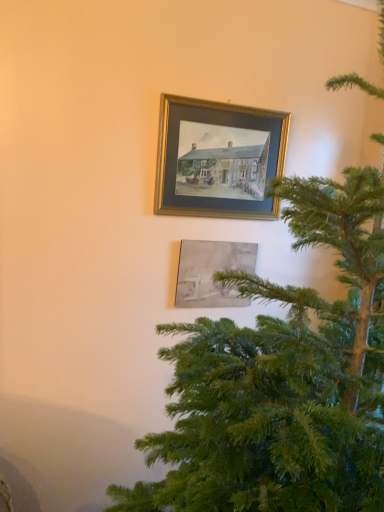
What do you see at coordinates (211, 272) in the screenshot?
I see `gray matte painting at lower center, arranged as the second picture frame when viewed from the top` at bounding box center [211, 272].

The width and height of the screenshot is (384, 512). Find the location of `green textured christmas tree at right`. green textured christmas tree at right is located at coordinates (283, 379).

Considering the sizes of green textured christmas tree at right and gray matte painting at lower center, arranged as the 1th picture frame when ordered from the bottom, in the image, is green textured christmas tree at right bigger or smaller than gray matte painting at lower center, arranged as the 1th picture frame when ordered from the bottom,?

Considering their sizes, green textured christmas tree at right takes up more space than gray matte painting at lower center, arranged as the 1th picture frame when ordered from the bottom.

Can you confirm if green textured christmas tree at right is positioned to the left of gray matte painting at lower center, arranged as the second picture frame when viewed from the top?

No, green textured christmas tree at right is not to the left of gray matte painting at lower center, arranged as the second picture frame when viewed from the top.

Can you tell me how much green textured christmas tree at right and gray matte painting at lower center, arranged as the second picture frame when viewed from the top, differ in facing direction?

The angular difference between green textured christmas tree at right and gray matte painting at lower center, arranged as the second picture frame when viewed from the top, is 86 degrees.

Is green textured christmas tree at right facing towards gray matte painting at lower center, arranged as the second picture frame when viewed from the top?

No, green textured christmas tree at right is not aimed at gray matte painting at lower center, arranged as the second picture frame when viewed from the top.

Is gold metallic picture frame at upper center, which is the 2th picture frame in bottom-to-top order, spatially inside green textured christmas tree at right, or outside of it?

gold metallic picture frame at upper center, which is the 2th picture frame in bottom-to-top order, is spatially situated outside green textured christmas tree at right.

The height and width of the screenshot is (512, 384). In order to click on christmas tree that is in front of the gold metallic picture frame at upper center, which is counted as the 1th picture frame, starting from the top in this screenshot , I will do `click(283, 379)`.

From a real-world perspective, is gold metallic picture frame at upper center, which is counted as the 1th picture frame, starting from the top, physically located above or below green textured christmas tree at right?

In terms of real-world spatial position, gold metallic picture frame at upper center, which is counted as the 1th picture frame, starting from the top, is above green textured christmas tree at right.

Which is more to the right, gold metallic picture frame at upper center, which is counted as the 1th picture frame, starting from the top, or green textured christmas tree at right?

green textured christmas tree at right.

From a real-world perspective, is gray matte painting at lower center, arranged as the 1th picture frame when ordered from the bottom, on gold metallic picture frame at upper center, which is the 2th picture frame in bottom-to-top order?

No, from a real-world perspective, gray matte painting at lower center, arranged as the 1th picture frame when ordered from the bottom, is not above gold metallic picture frame at upper center, which is the 2th picture frame in bottom-to-top order.

Is gray matte painting at lower center, arranged as the 1th picture frame when ordered from the bottom, oriented towards gold metallic picture frame at upper center, which is counted as the 1th picture frame, starting from the top?

No, gray matte painting at lower center, arranged as the 1th picture frame when ordered from the bottom, is not oriented towards gold metallic picture frame at upper center, which is counted as the 1th picture frame, starting from the top.

At what (x,y) coordinates should I click in order to perform the action: click on picture frame that is above the gray matte painting at lower center, arranged as the second picture frame when viewed from the top (from a real-world perspective). Please return your answer as a coordinate pair (x, y). Looking at the image, I should click on point(218,159).

Is gray matte painting at lower center, arranged as the second picture frame when viewed from the top, not inside gold metallic picture frame at upper center, which is counted as the 1th picture frame, starting from the top?

Yes, gray matte painting at lower center, arranged as the second picture frame when viewed from the top, is outside of gold metallic picture frame at upper center, which is counted as the 1th picture frame, starting from the top.

From a real-world perspective, who is located lower, gray matte painting at lower center, arranged as the second picture frame when viewed from the top, or green textured christmas tree at right?

green textured christmas tree at right, from a real-world perspective.

Does gray matte painting at lower center, arranged as the 1th picture frame when ordered from the bottom, have a lesser height compared to green textured christmas tree at right?

Correct, gray matte painting at lower center, arranged as the 1th picture frame when ordered from the bottom, is not as tall as green textured christmas tree at right.

Does gray matte painting at lower center, arranged as the second picture frame when viewed from the top, appear on the left side of green textured christmas tree at right?

Correct, you'll find gray matte painting at lower center, arranged as the second picture frame when viewed from the top, to the left of green textured christmas tree at right.

Between green textured christmas tree at right and gold metallic picture frame at upper center, which is the 2th picture frame in bottom-to-top order, which one appears on the right side from the viewer's perspective?

From the viewer's perspective, green textured christmas tree at right appears more on the right side.

Who is shorter, green textured christmas tree at right or gold metallic picture frame at upper center, which is the 2th picture frame in bottom-to-top order?

With less height is gold metallic picture frame at upper center, which is the 2th picture frame in bottom-to-top order.

Is green textured christmas tree at right placed right next to gold metallic picture frame at upper center, which is the 2th picture frame in bottom-to-top order?

There is a gap between green textured christmas tree at right and gold metallic picture frame at upper center, which is the 2th picture frame in bottom-to-top order.

Who is bigger, green textured christmas tree at right or gold metallic picture frame at upper center, which is counted as the 1th picture frame, starting from the top?

green textured christmas tree at right is bigger.

In the image, is gold metallic picture frame at upper center, which is counted as the 1th picture frame, starting from the top, on the left side or the right side of gray matte painting at lower center, arranged as the 1th picture frame when ordered from the bottom?

From the image, it's evident that gold metallic picture frame at upper center, which is counted as the 1th picture frame, starting from the top, is to the right of gray matte painting at lower center, arranged as the 1th picture frame when ordered from the bottom.

Is gold metallic picture frame at upper center, which is the 2th picture frame in bottom-to-top order, taller or shorter than gray matte painting at lower center, arranged as the 1th picture frame when ordered from the bottom?

Considering their sizes, gold metallic picture frame at upper center, which is the 2th picture frame in bottom-to-top order, has more height than gray matte painting at lower center, arranged as the 1th picture frame when ordered from the bottom.

The height and width of the screenshot is (512, 384). In the image, there is a gold metallic picture frame at upper center, which is counted as the 1th picture frame, starting from the top. In order to click on picture frame below it (from the image's perspective) in this screenshot , I will do `click(211, 272)`.

Is gold metallic picture frame at upper center, which is counted as the 1th picture frame, starting from the top, not near gray matte painting at lower center, arranged as the second picture frame when viewed from the top?

No, gold metallic picture frame at upper center, which is counted as the 1th picture frame, starting from the top, is not far away from gray matte painting at lower center, arranged as the second picture frame when viewed from the top.

Locate an element on the screen. christmas tree below the gray matte painting at lower center, arranged as the 1th picture frame when ordered from the bottom (from the image's perspective) is located at coordinates click(x=283, y=379).

Where is `picture frame that is the 2nd object above the green textured christmas tree at right (from a real-world perspective)`? This screenshot has width=384, height=512. picture frame that is the 2nd object above the green textured christmas tree at right (from a real-world perspective) is located at coordinates (218, 159).

From the image, which object appears to be farther from green textured christmas tree at right, gray matte painting at lower center, arranged as the second picture frame when viewed from the top, or gold metallic picture frame at upper center, which is the 2th picture frame in bottom-to-top order?

gold metallic picture frame at upper center, which is the 2th picture frame in bottom-to-top order, is positioned further to the anchor green textured christmas tree at right.

Looking at the image, which one is located further to gray matte painting at lower center, arranged as the second picture frame when viewed from the top, gold metallic picture frame at upper center, which is the 2th picture frame in bottom-to-top order, or green textured christmas tree at right?

green textured christmas tree at right lies further to gray matte painting at lower center, arranged as the second picture frame when viewed from the top, than the other object.

Estimate the real-world distances between objects in this image. Which object is closer to gray matte painting at lower center, arranged as the second picture frame when viewed from the top, green textured christmas tree at right or gold metallic picture frame at upper center, which is the 2th picture frame in bottom-to-top order?

gold metallic picture frame at upper center, which is the 2th picture frame in bottom-to-top order.

Which object lies further to the anchor point green textured christmas tree at right, gold metallic picture frame at upper center, which is counted as the 1th picture frame, starting from the top, or gray matte painting at lower center, arranged as the second picture frame when viewed from the top?

gold metallic picture frame at upper center, which is counted as the 1th picture frame, starting from the top, is positioned further to the anchor green textured christmas tree at right.

Based on their spatial positions, is gray matte painting at lower center, arranged as the second picture frame when viewed from the top, or green textured christmas tree at right closer to gold metallic picture frame at upper center, which is the 2th picture frame in bottom-to-top order?

The object closer to gold metallic picture frame at upper center, which is the 2th picture frame in bottom-to-top order, is gray matte painting at lower center, arranged as the second picture frame when viewed from the top.

Looking at the image, which one is located closer to gold metallic picture frame at upper center, which is counted as the 1th picture frame, starting from the top, green textured christmas tree at right or gray matte painting at lower center, arranged as the 1th picture frame when ordered from the bottom?

gray matte painting at lower center, arranged as the 1th picture frame when ordered from the bottom, is positioned closer to the anchor gold metallic picture frame at upper center, which is counted as the 1th picture frame, starting from the top.

Locate an element on the screen. This screenshot has height=512, width=384. picture frame located between green textured christmas tree at right and gray matte painting at lower center, arranged as the 1th picture frame when ordered from the bottom, in the depth direction is located at coordinates (218, 159).